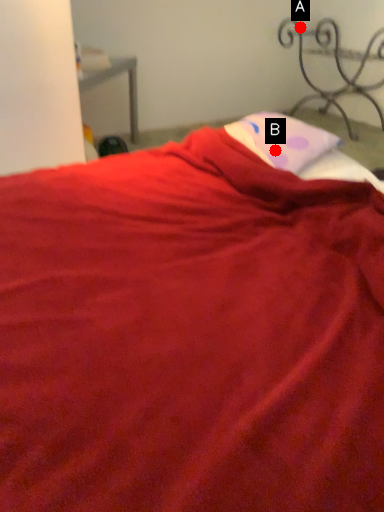
Question: Two points are circled on the image, labeled by A and B beside each circle. Which point is closer to the camera?

Choices:
 (A) A is closer
 (B) B is closer

Answer: (B)